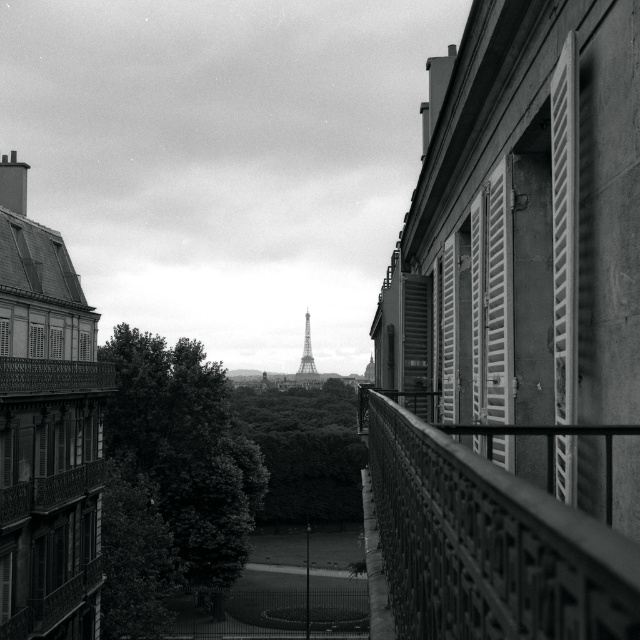
Between smooth metal railing at center right and white wooden shutters at right, which one appears on the right side from the viewer's perspective?

From the viewer's perspective, white wooden shutters at right appears more on the right side.

Measure the distance between point (474, 472) and camera.

Point (474, 472) is 1.99 meters from camera.

This screenshot has height=640, width=640. Describe the element at coordinates (486, 545) in the screenshot. I see `smooth metal railing at center right` at that location.

The image size is (640, 640). I want to click on smooth metal railing at center right, so click(x=486, y=545).

Does green leafy tree at center appear on the left side of white wood shutter at right?

Indeed, green leafy tree at center is positioned on the left side of white wood shutter at right.

Between point (340, 448) and point (456, 257), which one is positioned in front?

Positioned in front is point (456, 257).

Is point (308, 476) closer to viewer compared to point (442, 310)?

No, it is behind (442, 310).

Locate an element on the screen. This screenshot has height=640, width=640. green leafy tree at center is located at coordinates (305, 451).

Is green leafy tree at center below white wooden shutters at right?

Yes.

At what (x,y) coordinates should I click in order to perform the action: click on green leafy tree at center. Please return your answer as a coordinate pair (x, y). This screenshot has height=640, width=640. Looking at the image, I should click on (305, 451).

Image resolution: width=640 pixels, height=640 pixels. I want to click on green leafy tree at center, so click(x=305, y=451).